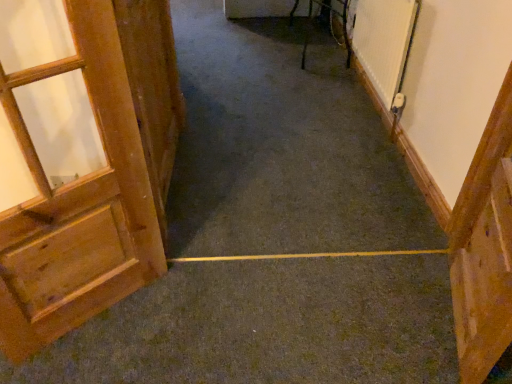
Describe the element at coordinates (484, 248) in the screenshot. The image size is (512, 384). I see `wooden door at right, which appears as the 1th door when viewed from the right` at that location.

From the picture: Measure the distance between metallic silver chair at upper right and camera.

The distance of metallic silver chair at upper right from camera is 3.08 meters.

Image resolution: width=512 pixels, height=384 pixels. I want to click on wooden door at left, which is the first door in left-to-right order, so click(79, 160).

Describe the element at coordinates (79, 160) in the screenshot. I see `wooden door at left, arranged as the 3th door when viewed from the right` at that location.

Locate an element on the screen. The width and height of the screenshot is (512, 384). wooden door at left, the second door from the right is located at coordinates (153, 89).

In order to click on wooden door at right, which appears as the 1th door when viewed from the right in this screenshot , I will do `click(484, 248)`.

Where is `door that is the 2nd object above the metallic silver chair at upper right (from a real-world perspective)`? door that is the 2nd object above the metallic silver chair at upper right (from a real-world perspective) is located at coordinates (153, 89).

Which object is closer to the camera, metallic silver chair at upper right or wooden door at left, arranged as the 2th door when viewed from the left?

wooden door at left, arranged as the 2th door when viewed from the left, is in front.

Can you tell me how much metallic silver chair at upper right and wooden door at left, the second door from the right, differ in facing direction?

The facing directions of metallic silver chair at upper right and wooden door at left, the second door from the right, are 179 degrees apart.

Considering the sizes of objects metallic silver chair at upper right and wooden door at left, arranged as the 2th door when viewed from the left, in the image provided, who is thinner, metallic silver chair at upper right or wooden door at left, arranged as the 2th door when viewed from the left,?

Thinner between the two is wooden door at left, arranged as the 2th door when viewed from the left.

From the image's perspective, is wooden door at right, the third door in the left-to-right sequence, over wooden door at left, the second door from the right?

No, from the image's perspective, wooden door at right, the third door in the left-to-right sequence, is not on top of wooden door at left, the second door from the right.

Is wooden door at right, which appears as the 1th door when viewed from the right, next to wooden door at left, the second door from the right?

No, wooden door at right, which appears as the 1th door when viewed from the right, is not with wooden door at left, the second door from the right.

Does wooden door at right, the third door in the left-to-right sequence, come behind wooden door at left, arranged as the 2th door when viewed from the left?

No, the depth of wooden door at right, the third door in the left-to-right sequence, is less than that of wooden door at left, arranged as the 2th door when viewed from the left.

Considering the sizes of objects wooden door at right, which appears as the 1th door when viewed from the right, and wooden door at left, the second door from the right, in the image provided, who is shorter, wooden door at right, which appears as the 1th door when viewed from the right, or wooden door at left, the second door from the right,?

wooden door at right, which appears as the 1th door when viewed from the right.

From a real-world perspective, who is located higher, wooden door at right, the third door in the left-to-right sequence, or metallic silver chair at upper right?

wooden door at right, the third door in the left-to-right sequence, is physically above.

Is wooden door at right, the third door in the left-to-right sequence, inside the boundaries of metallic silver chair at upper right, or outside?

wooden door at right, the third door in the left-to-right sequence, is located beyond the bounds of metallic silver chair at upper right.

From the image's perspective, is wooden door at right, the third door in the left-to-right sequence, below metallic silver chair at upper right?

Yes.

From a real-world perspective, is wooden door at left, the second door from the right, positioned under wooden door at left, arranged as the 3th door when viewed from the right, based on gravity?

Yes, from a real-world perspective, wooden door at left, the second door from the right, is beneath wooden door at left, arranged as the 3th door when viewed from the right.

Is wooden door at left, arranged as the 2th door when viewed from the left, to the left of wooden door at left, arranged as the 3th door when viewed from the right, from the viewer's perspective?

No.

Is wooden door at left, arranged as the 2th door when viewed from the left, wider than wooden door at left, which is the first door in left-to-right order?

In fact, wooden door at left, arranged as the 2th door when viewed from the left, might be narrower than wooden door at left, which is the first door in left-to-right order.

Is wooden door at left, arranged as the 2th door when viewed from the left, surrounding wooden door at left, arranged as the 3th door when viewed from the right?

No, wooden door at left, arranged as the 2th door when viewed from the left, does not contain wooden door at left, arranged as the 3th door when viewed from the right.

Considering the sizes of objects wooden door at left, arranged as the 3th door when viewed from the right, and wooden door at left, arranged as the 2th door when viewed from the left, in the image provided, who is thinner, wooden door at left, arranged as the 3th door when viewed from the right, or wooden door at left, arranged as the 2th door when viewed from the left,?

wooden door at left, arranged as the 2th door when viewed from the left, is thinner.

Considering the sizes of objects wooden door at left, which is the first door in left-to-right order, and wooden door at left, the second door from the right, in the image provided, who is shorter, wooden door at left, which is the first door in left-to-right order, or wooden door at left, the second door from the right,?

With less height is wooden door at left, the second door from the right.

From the image's perspective, does wooden door at left, arranged as the 3th door when viewed from the right, appear higher than wooden door at left, arranged as the 2th door when viewed from the left?

No.

Is the depth of wooden door at left, which is the first door in left-to-right order, greater than that of wooden door at left, arranged as the 2th door when viewed from the left?

No, it is not.

Considering the sizes of objects wooden door at left, arranged as the 3th door when viewed from the right, and metallic silver chair at upper right in the image provided, who is wider, wooden door at left, arranged as the 3th door when viewed from the right, or metallic silver chair at upper right?

metallic silver chair at upper right.

Which of these two, wooden door at left, which is the first door in left-to-right order, or metallic silver chair at upper right, stands taller?

With more height is wooden door at left, which is the first door in left-to-right order.

Is wooden door at left, which is the first door in left-to-right order, positioned with its back to metallic silver chair at upper right?

No.

Who is bigger, wooden door at left, which is the first door in left-to-right order, or wooden door at right, the third door in the left-to-right sequence?

Bigger between the two is wooden door at left, which is the first door in left-to-right order.

From a real-world perspective, which object stands above the other?

wooden door at left, which is the first door in left-to-right order, is physically above.

Would you say wooden door at left, arranged as the 3th door when viewed from the right, is outside wooden door at right, the third door in the left-to-right sequence?

wooden door at left, arranged as the 3th door when viewed from the right, lies outside wooden door at right, the third door in the left-to-right sequence,'s area.

From the picture: Between wooden door at left, which is the first door in left-to-right order, and wooden door at right, the third door in the left-to-right sequence, which one is positioned behind?

wooden door at right, the third door in the left-to-right sequence, is more distant.

This screenshot has width=512, height=384. I want to click on the 2nd door directly above the metallic silver chair at upper right (from a real-world perspective), so click(x=153, y=89).

Locate an element on the screen. The height and width of the screenshot is (384, 512). door behind the wooden door at right, which appears as the 1th door when viewed from the right is located at coordinates (153, 89).

Looking at the image, which one is located closer to wooden door at right, which appears as the 1th door when viewed from the right, wooden door at left, arranged as the 2th door when viewed from the left, or metallic silver chair at upper right?

wooden door at left, arranged as the 2th door when viewed from the left, is closer to wooden door at right, which appears as the 1th door when viewed from the right.

When comparing their distances from wooden door at left, arranged as the 2th door when viewed from the left, does wooden door at left, arranged as the 3th door when viewed from the right, or metallic silver chair at upper right seem closer?

The object closer to wooden door at left, arranged as the 2th door when viewed from the left, is wooden door at left, arranged as the 3th door when viewed from the right.

Consider the image. From the image, which object appears to be farther from wooden door at left, arranged as the 2th door when viewed from the left, metallic silver chair at upper right or wooden door at right, which appears as the 1th door when viewed from the right?

Among the two, metallic silver chair at upper right is located further to wooden door at left, arranged as the 2th door when viewed from the left.

From the image, which object appears to be farther from wooden door at right, the third door in the left-to-right sequence, wooden door at left, arranged as the 3th door when viewed from the right, or metallic silver chair at upper right?

Based on the image, metallic silver chair at upper right appears to be further to wooden door at right, the third door in the left-to-right sequence.

Considering their positions, is metallic silver chair at upper right positioned further to wooden door at left, which is the first door in left-to-right order, than wooden door at right, the third door in the left-to-right sequence?

metallic silver chair at upper right is further to wooden door at left, which is the first door in left-to-right order.

Which object lies further to the anchor point wooden door at left, arranged as the 3th door when viewed from the right, wooden door at left, arranged as the 2th door when viewed from the left, or metallic silver chair at upper right?

Based on the image, metallic silver chair at upper right appears to be further to wooden door at left, arranged as the 3th door when viewed from the right.

Which object lies nearer to the anchor point wooden door at right, which appears as the 1th door when viewed from the right, wooden door at left, the second door from the right, or wooden door at left, arranged as the 3th door when viewed from the right?

The object closer to wooden door at right, which appears as the 1th door when viewed from the right, is wooden door at left, arranged as the 3th door when viewed from the right.

From the picture: Considering their positions, is metallic silver chair at upper right positioned further to wooden door at left, arranged as the 2th door when viewed from the left, than wooden door at left, which is the first door in left-to-right order?

metallic silver chair at upper right is positioned further to the anchor wooden door at left, arranged as the 2th door when viewed from the left.

I want to click on door located between wooden door at left, which is the first door in left-to-right order, and wooden door at right, which appears as the 1th door when viewed from the right, in the left-right direction, so click(153, 89).

Locate an element on the screen. This screenshot has height=384, width=512. door between wooden door at right, the third door in the left-to-right sequence, and metallic silver chair at upper right, along the z-axis is located at coordinates (153, 89).